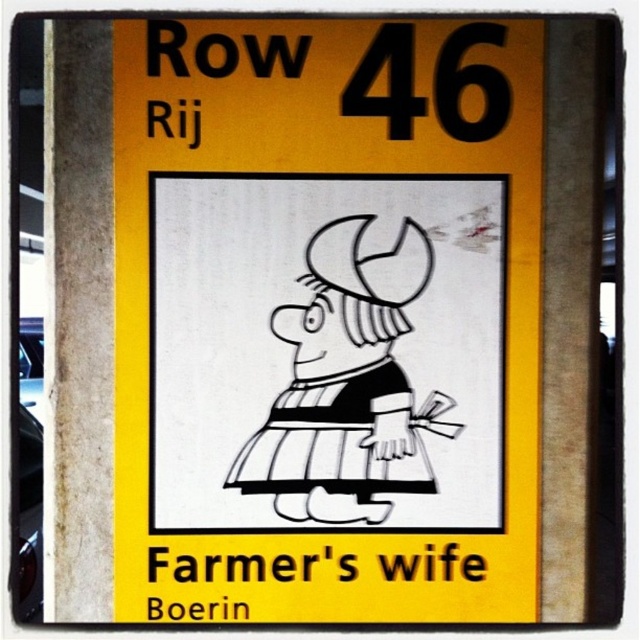
The image size is (640, 640). What do you see at coordinates (326, 317) in the screenshot? I see `yellow paper sign at center` at bounding box center [326, 317].

Between point (518, 241) and point (323, 435), which one is positioned behind?

Point (323, 435)

Identify the location of yellow paper sign at center. This screenshot has width=640, height=640. (326, 317).